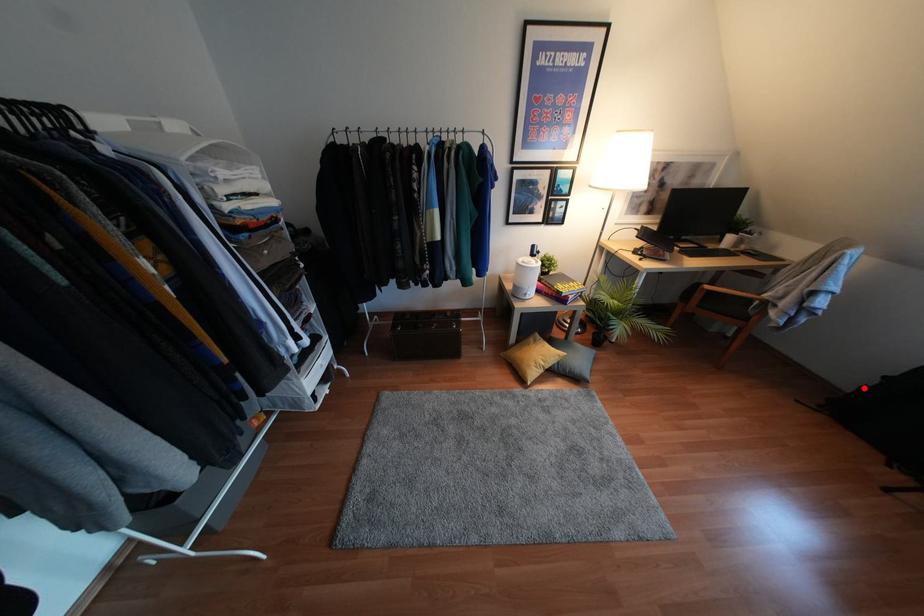
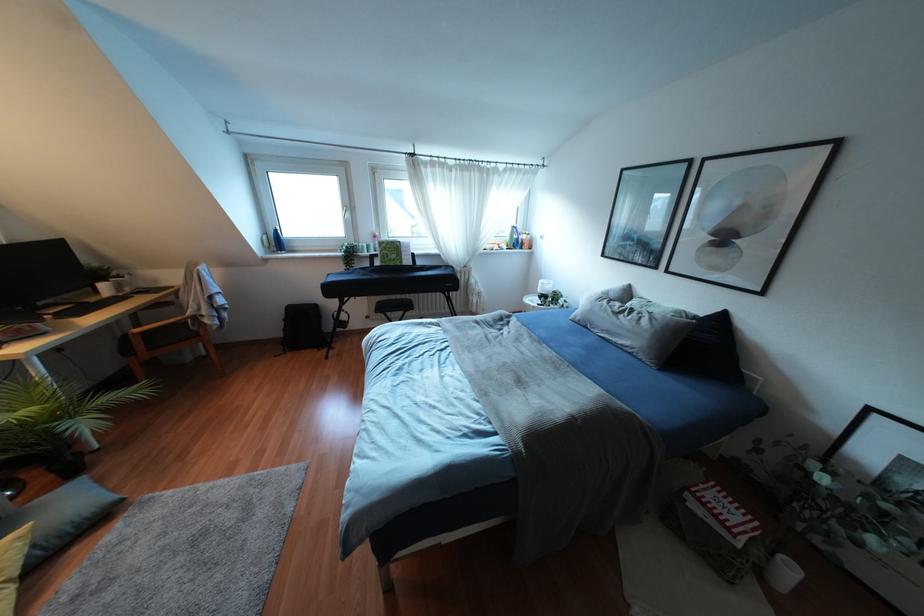
In the second image, find the point that corresponds to the highlighted location in the first image.

(284, 329)